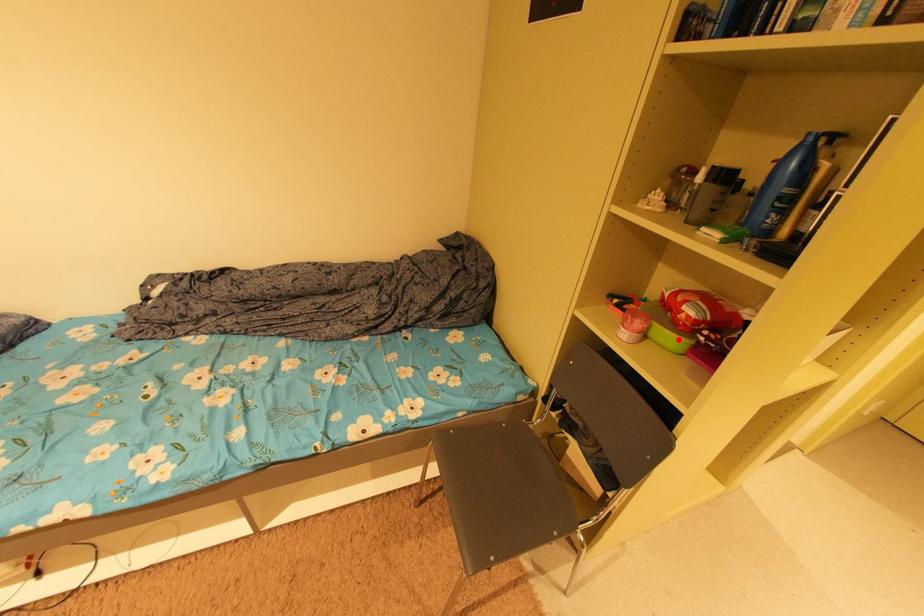
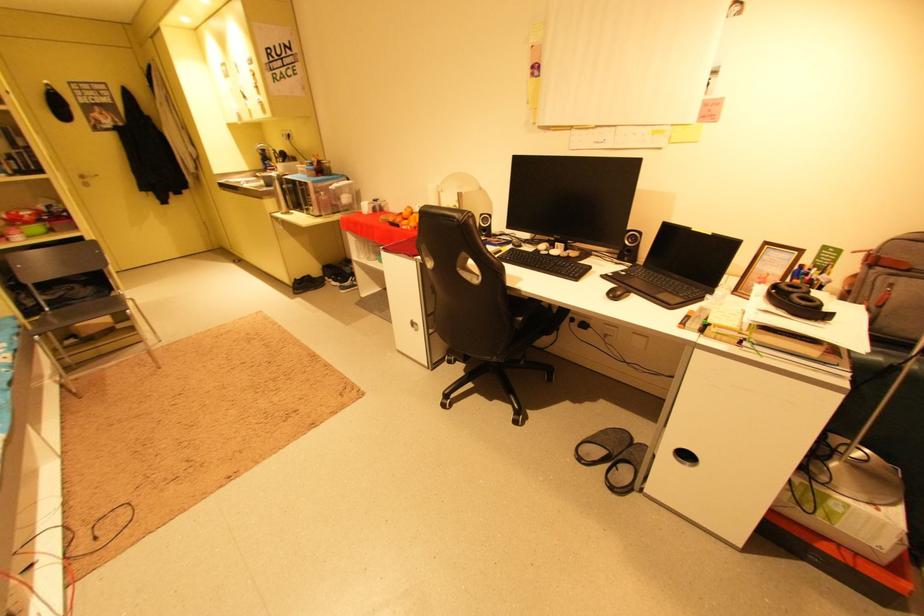
Question: I am providing you with two images of the same scene from different viewpoints. A red point is shown in image1. For the corresponding object point in image2, is it positioned nearer or farther from the camera?

Choices:
 (A) Nearer
 (B) Farther

Answer: (B)